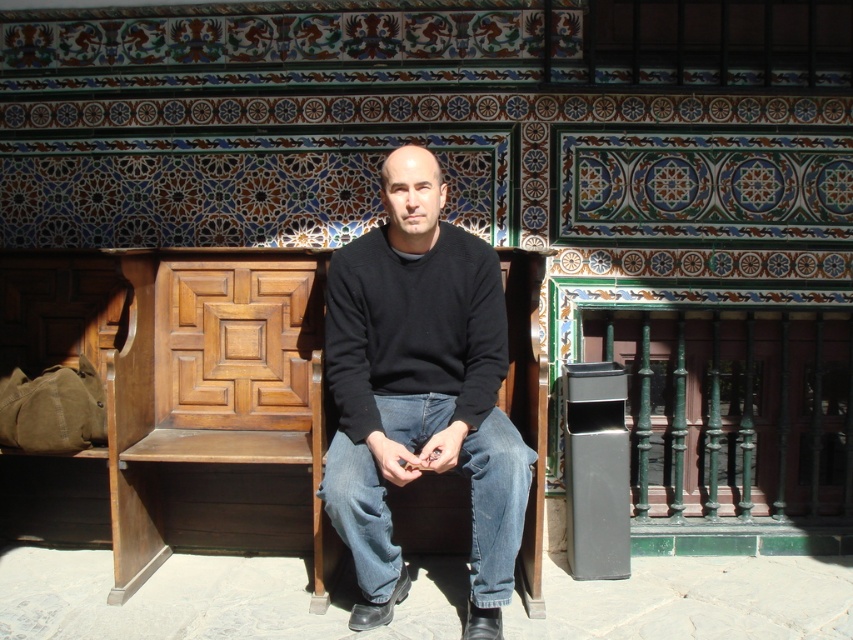
Describe the element at coordinates (413, 326) in the screenshot. I see `black knitted sweater at center` at that location.

Between point (339, 248) and point (440, 413), which one is positioned in front?

Point (440, 413) is more forward.

Which is in front, point (358, 316) or point (368, 477)?

Point (368, 477) is in front.

I want to click on black knitted sweater at center, so click(x=413, y=326).

Who is more distant from viewer, (404, 404) or (403, 337)?

The point (404, 404) is behind.

The height and width of the screenshot is (640, 853). I want to click on black sweater at center, so click(421, 392).

Identify the location of black sweater at center. The image size is (853, 640). (421, 392).

Is point (494, 362) farther from viewer compared to point (374, 493)?

That is True.

Which is behind, point (486, 385) or point (521, 477)?

Point (486, 385)

You are a GUI agent. You are given a task and a screenshot of the screen. Output one action in this format:
    pyautogui.click(x=<x>, y=<y>)
    Task: Click on the black sweater at center
    
    Given the screenshot: What is the action you would take?
    pyautogui.click(x=421, y=392)